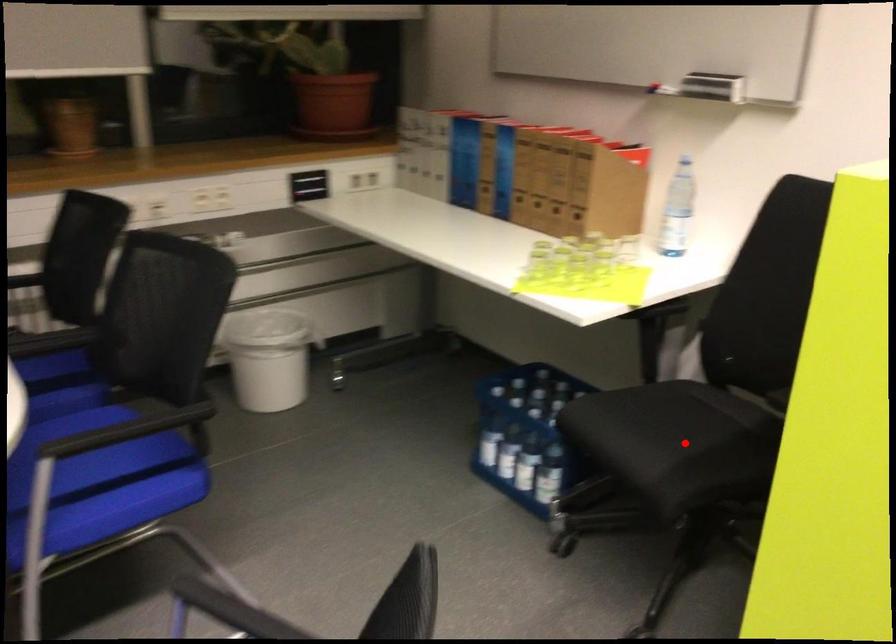
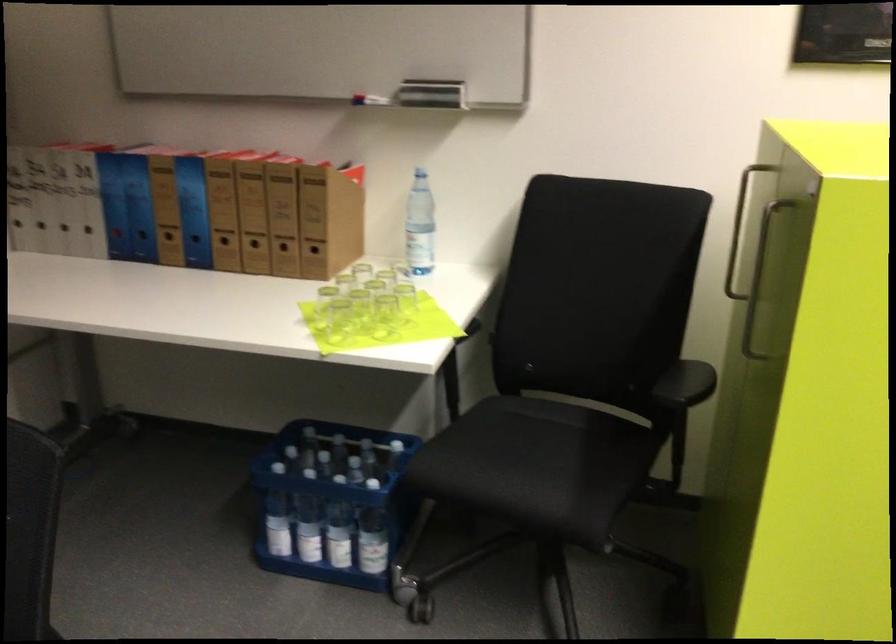
The point at the highlighted location is marked in the first image. Where is the corresponding point in the second image?

(552, 462)